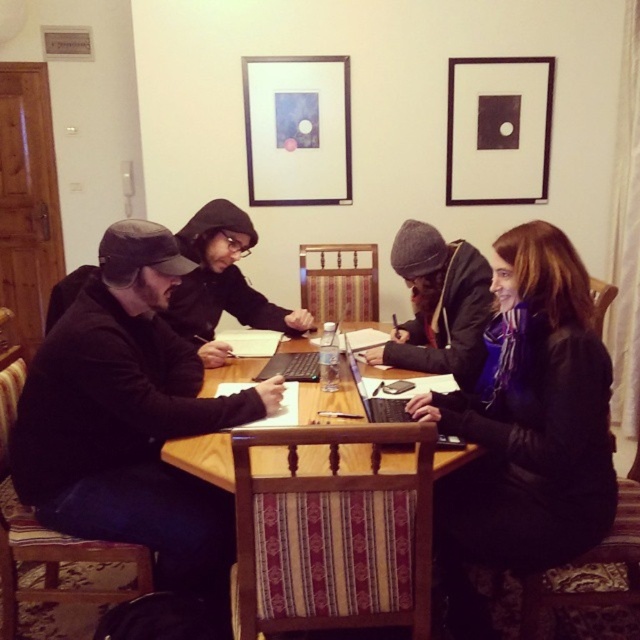
Does matte black jacket at left appear on the right side of black matte picture frame at upper right?

No, matte black jacket at left is not to the right of black matte picture frame at upper right.

Can you confirm if matte black jacket at left is positioned below black matte picture frame at upper right?

Indeed, matte black jacket at left is positioned under black matte picture frame at upper right.

At what (x,y) coordinates should I click in order to perform the action: click on matte black jacket at left. Please return your answer as a coordinate pair (x, y). Looking at the image, I should click on (129, 417).

Find the location of a particular element. matte black jacket at left is located at coordinates (129, 417).

What do you see at coordinates (129, 417) in the screenshot?
I see `matte black jacket at left` at bounding box center [129, 417].

Is matte black jacket at left to the left of dark blue scarf at center from the viewer's perspective?

Indeed, matte black jacket at left is positioned on the left side of dark blue scarf at center.

The height and width of the screenshot is (640, 640). In order to click on matte black jacket at left in this screenshot , I will do `click(129, 417)`.

The height and width of the screenshot is (640, 640). Identify the location of matte glass picture frame at upper center. (298, 129).

Is point (285, 112) positioned after point (426, 356)?

Yes.

At what (x,y) coordinates should I click in order to perform the action: click on matte glass picture frame at upper center. Please return your answer as a coordinate pair (x, y). Looking at the image, I should click on (298, 129).